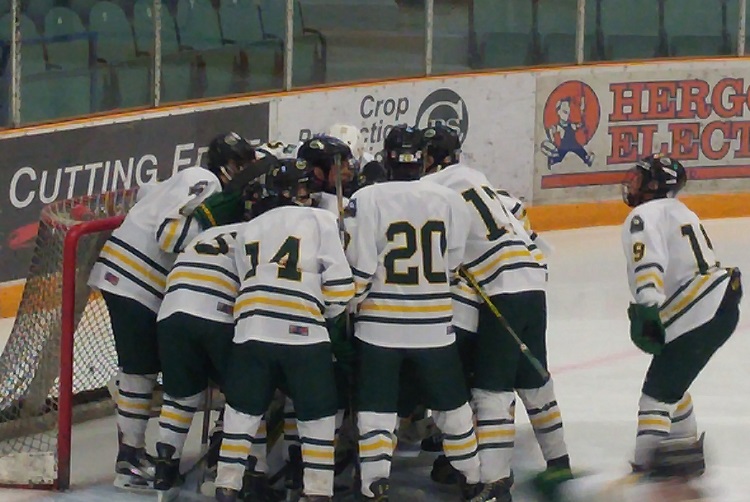
Identify the location of glass. The image size is (750, 502). (82, 50), (222, 37), (388, 43), (525, 36), (687, 30).